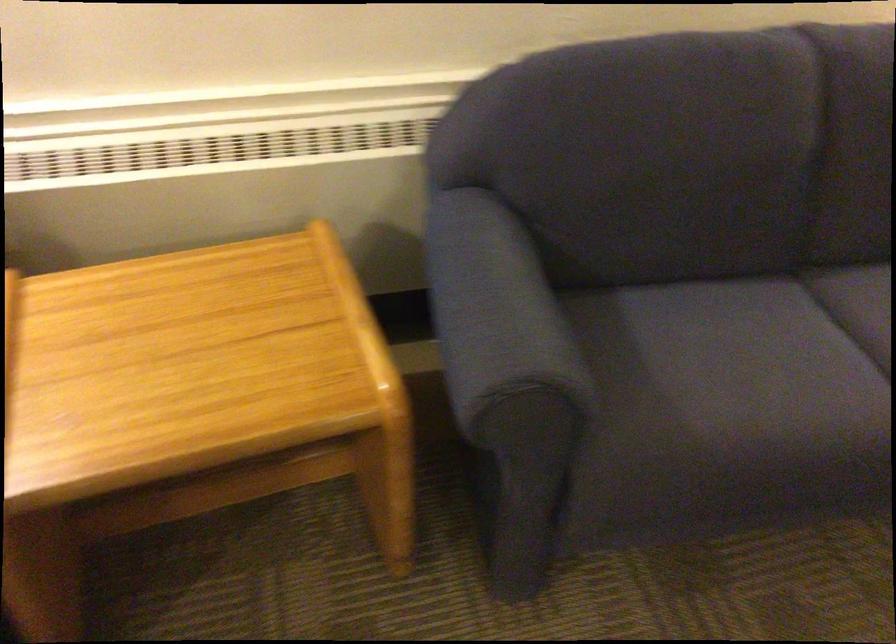
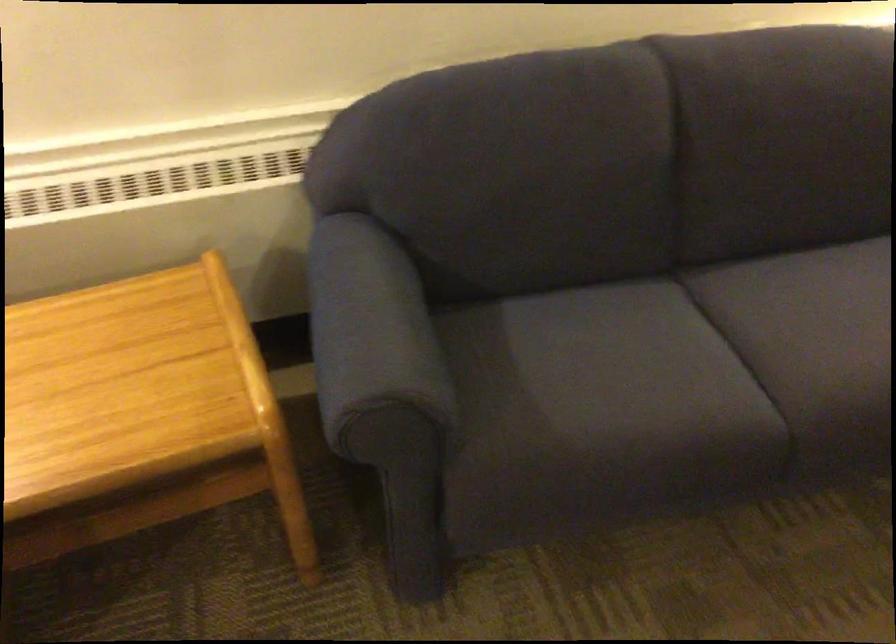
In a continuous first-person perspective shot, in which direction is the camera moving?

The cameraman moved toward right, backward.